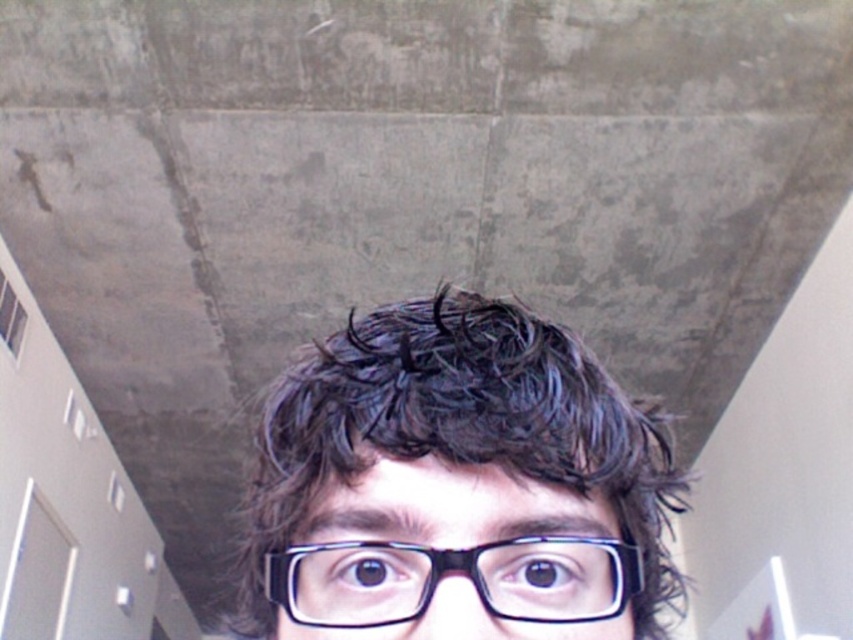
Is point (502, 404) less distant than point (546, 598)?

No, (502, 404) is behind (546, 598).

Is point (254, 536) positioned behind point (497, 579)?

Yes, it is behind point (497, 579).

You are a GUI agent. You are given a task and a screenshot of the screen. Output one action in this format:
    pyautogui.click(x=<x>, y=<y>)
    Task: Click on the black glossy glasses at center
    This screenshot has height=640, width=853.
    Given the screenshot: What is the action you would take?
    pyautogui.click(x=457, y=484)